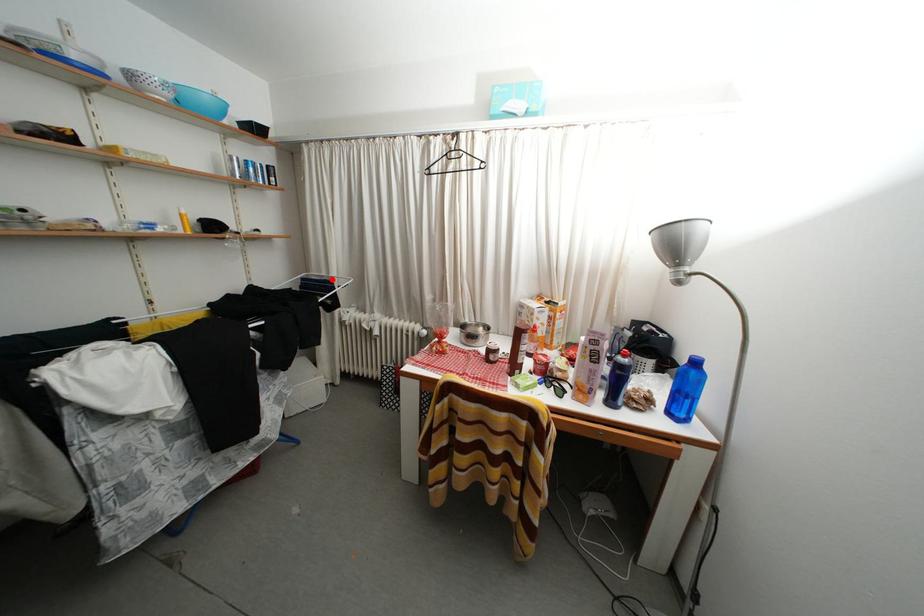
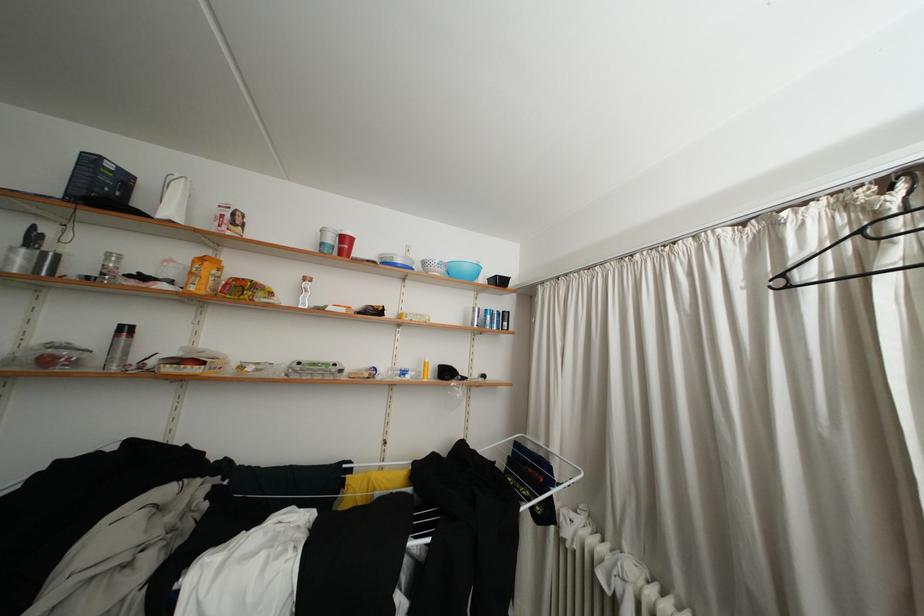
Where in the second image is the point corresponding to the highlighted location from the first image?

(550, 448)